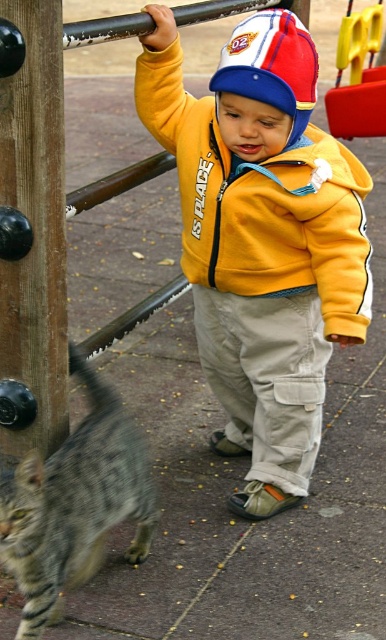
Can you confirm if brown wooden pole at left is taller than gray striped fur at lower left?

Yes, brown wooden pole at left is taller than gray striped fur at lower left.

Which is in front, point (25, 4) or point (123, 458)?

Point (25, 4) is more forward.

Which is behind, point (25, 337) or point (16, 545)?

Positioned behind is point (25, 337).

The height and width of the screenshot is (640, 386). What are the coordinates of `brown wooden pole at left` in the screenshot? It's located at (35, 225).

Who is positioned more to the right, yellow fleece jacket at center or gray striped fur at lower left?

yellow fleece jacket at center is more to the right.

Can you confirm if yellow fleece jacket at center is thinner than gray striped fur at lower left?

No.

Describe the element at coordinates (262, 240) in the screenshot. I see `yellow fleece jacket at center` at that location.

Locate an element on the screen. yellow fleece jacket at center is located at coordinates (262, 240).

Who is more forward, (x=289, y=74) or (x=13, y=97)?

Point (x=13, y=97)

Between point (231, 244) and point (25, 349), which one is positioned in front?

Point (25, 349) is more forward.

The width and height of the screenshot is (386, 640). I want to click on yellow fleece jacket at center, so click(262, 240).